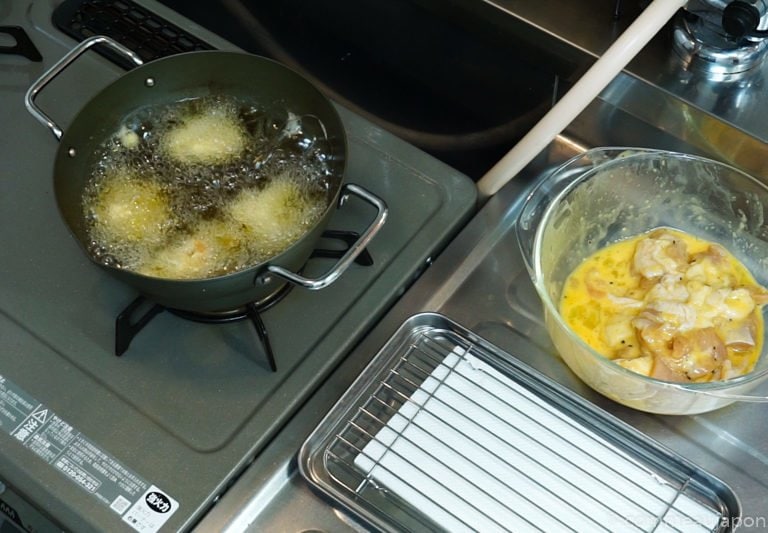
Find the location of a particular element. silver pot handle is located at coordinates (313, 281), (31, 108).